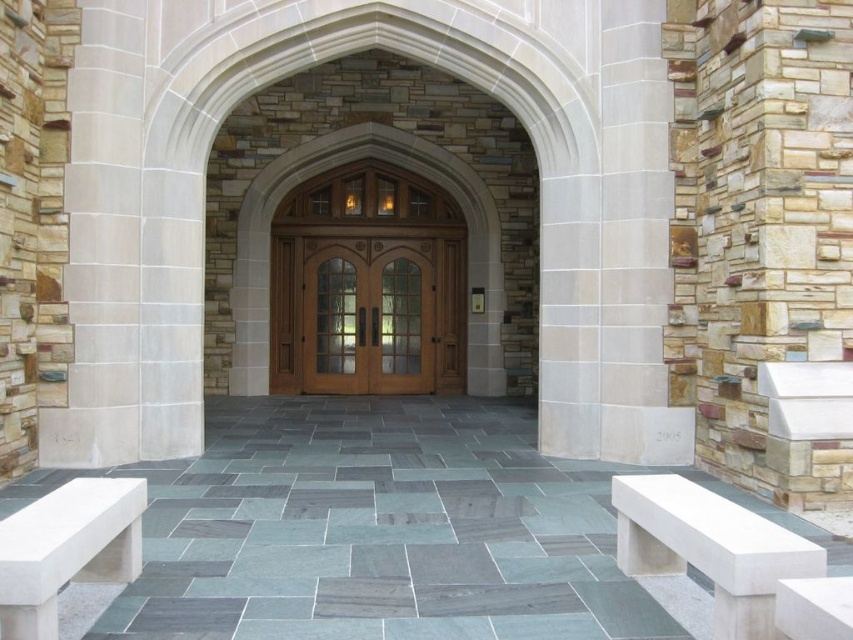
Based on the scene description, what are the coordinates of the mahogany wood double doors at center?

The coordinates of the mahogany wood double doors at center are at point (367, 314).

You are an architect designing a new building and want to ensure accessibility. The standard wheelchair ramp must be at least 80 cm wide. Given the space between the mahogany wood double doors at center and the white stone bench at lower right, can you determine if the ramp will fit?

The mahogany wood double doors at center has a larger size compared to the white stone bench at lower right. However, the exact dimensions of the space between them are not provided in the scene description. Without specific measurements of the gap, it is impossible to confirm if the ramp will fit. Please provide more details about the distance between the doors and the bench.